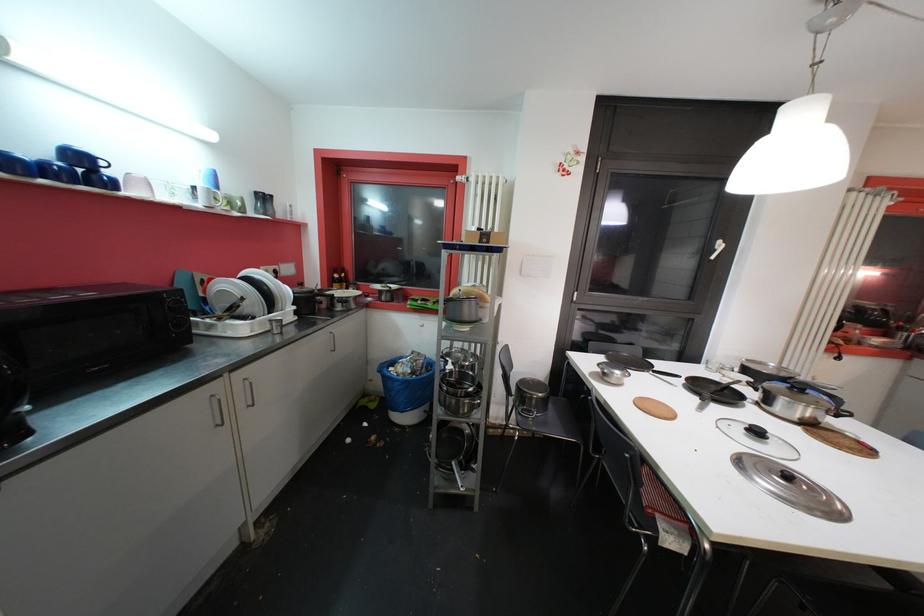
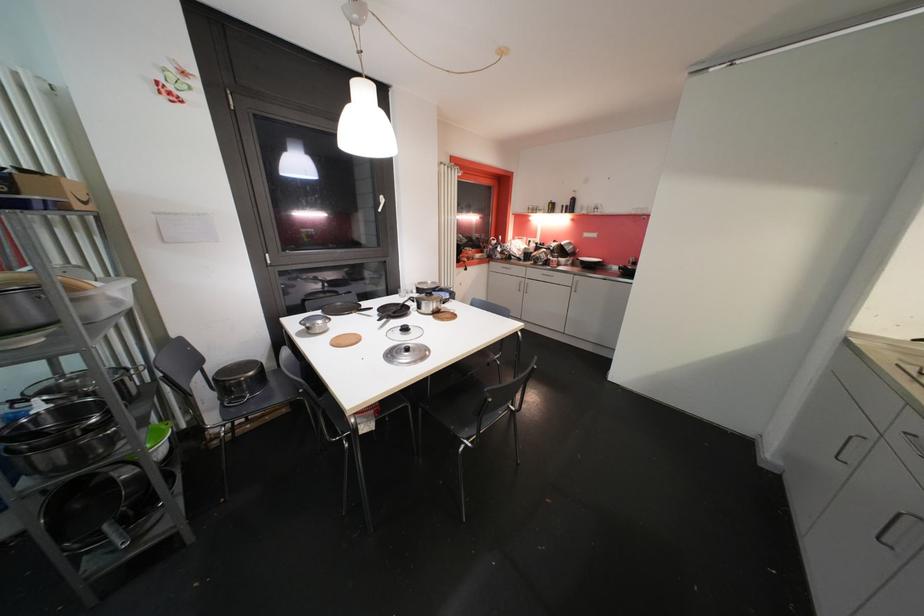
Question: The first image is from the beginning of the video and the second image is from the end. How did the camera likely rotate when shooting the video?

Choices:
 (A) Left
 (B) Right
 (C) Up
 (D) Down

Answer: (B)